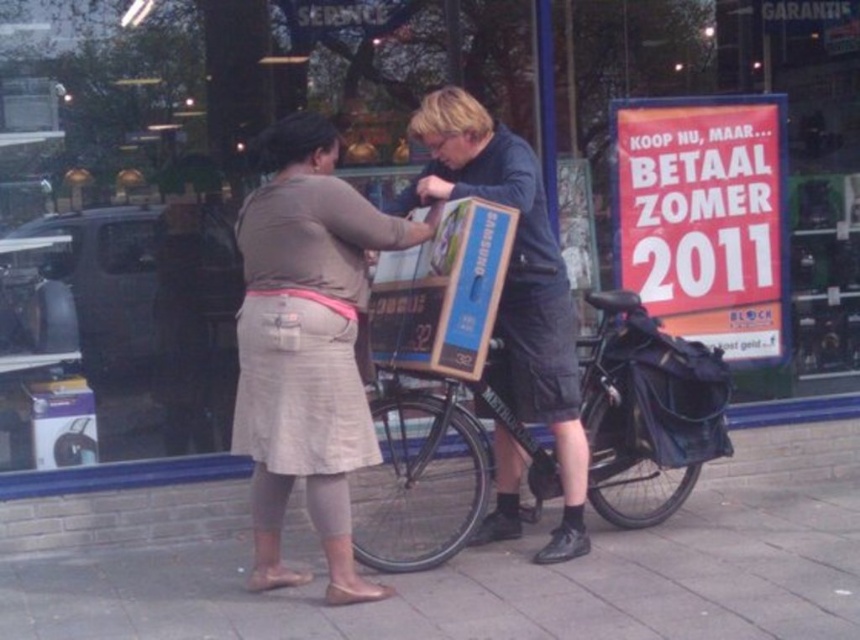
You are taking a photo of the scene and want to focus on both point [14,572] and point [416,404]. Which point should you focus on first to ensure both are in focus?

You should focus on point [14,572] first because it is closer to the camera than point [416,404]. By focusing on the closer point, the farther point will also be in focus due to depth of field.